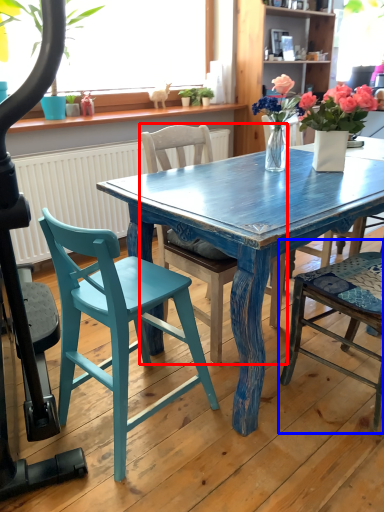
Question: Which object appears closest to the camera in this image, chair (highlighted by a red box) or chair (highlighted by a blue box)?

Choices:
 (A) chair
 (B) chair

Answer: (B)